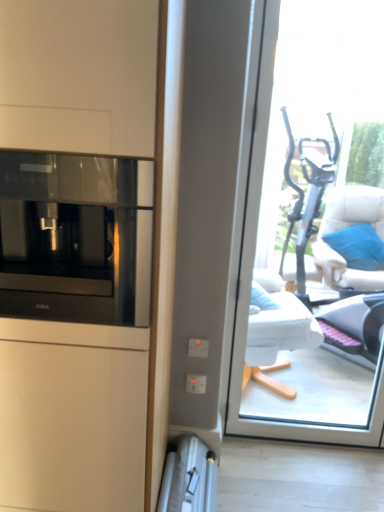
Question: Considering the relative sizes of white fabric chair at right and black glass microwave at left in the image provided, is white fabric chair at right taller than black glass microwave at left?

Choices:
 (A) no
 (B) yes

Answer: (B)

Question: Are white fabric chair at right and black glass microwave at left making contact?

Choices:
 (A) yes
 (B) no

Answer: (B)

Question: Is white fabric chair at right aimed at black glass microwave at left?

Choices:
 (A) yes
 (B) no

Answer: (B)

Question: Is black glass microwave at left inside white fabric chair at right?

Choices:
 (A) yes
 (B) no

Answer: (B)

Question: From a real-world perspective, is white fabric chair at right located beneath black glass microwave at left?

Choices:
 (A) no
 (B) yes

Answer: (B)

Question: From the image's perspective, relative to black glass microwave at left, is transparent glass window at center above or below?

Choices:
 (A) below
 (B) above

Answer: (A)

Question: Is point (382, 109) closer or farther from the camera than point (109, 247)?

Choices:
 (A) farther
 (B) closer

Answer: (A)

Question: Which is correct: transparent glass window at center is inside black glass microwave at left, or outside of it?

Choices:
 (A) outside
 (B) inside

Answer: (A)

Question: In terms of size, does transparent glass window at center appear bigger or smaller than black glass microwave at left?

Choices:
 (A) big
 (B) small

Answer: (A)

Question: From the image's perspective, relative to silver metallic ladder at lower center, is black glass microwave at left above or below?

Choices:
 (A) above
 (B) below

Answer: (A)

Question: Visually, is black glass microwave at left positioned to the left or to the right of silver metallic ladder at lower center?

Choices:
 (A) right
 (B) left

Answer: (B)

Question: In terms of size, does black glass microwave at left appear bigger or smaller than silver metallic ladder at lower center?

Choices:
 (A) big
 (B) small

Answer: (A)

Question: Is black glass microwave at left in front of or behind silver metallic ladder at lower center in the image?

Choices:
 (A) front
 (B) behind

Answer: (A)

Question: Which is correct: silver metallic ladder at lower center is inside white fabric chair at right, or outside of it?

Choices:
 (A) outside
 (B) inside

Answer: (A)

Question: Is point (167, 490) positioned closer to the camera than point (354, 205)?

Choices:
 (A) farther
 (B) closer

Answer: (B)